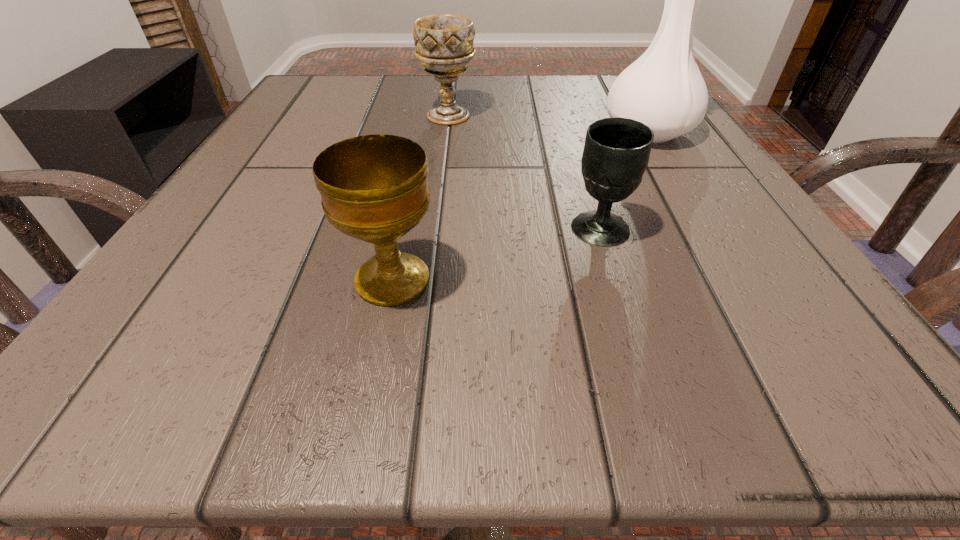
I want to click on free space between the second farthest chalice and the farthest chalice, so click(x=524, y=172).

Identify the location of free spot between the nearest object and the vase. The width and height of the screenshot is (960, 540). (520, 206).

Where is `free spot between the rightmost object and the nearest object`? free spot between the rightmost object and the nearest object is located at coordinates (520, 206).

Locate an element on the screen. The image size is (960, 540). free space that is in between the farthest chalice and the vase is located at coordinates (548, 124).

Image resolution: width=960 pixels, height=540 pixels. Find the location of `free spot between the vase and the farthest chalice`. free spot between the vase and the farthest chalice is located at coordinates (548, 124).

Locate an element on the screen. The width and height of the screenshot is (960, 540). free space that is in between the rightmost chalice and the nearest chalice is located at coordinates (496, 254).

This screenshot has width=960, height=540. What are the coordinates of `empty location between the nearest chalice and the vase` in the screenshot? It's located at (520, 206).

Find the location of a particular element. object that is the second closest one to the rightmost chalice is located at coordinates (374, 188).

Identify which object is the closest to the nearest chalice. Please provide its 2D coordinates. Your answer should be formatted as a tuple, i.e. [(x, y)], where the tuple contains the x and y coordinates of a point satisfying the conditions above.

[(616, 153)]

Locate an element on the screen. This screenshot has width=960, height=540. chalice that is the closest to the third object from left to right is located at coordinates (374, 188).